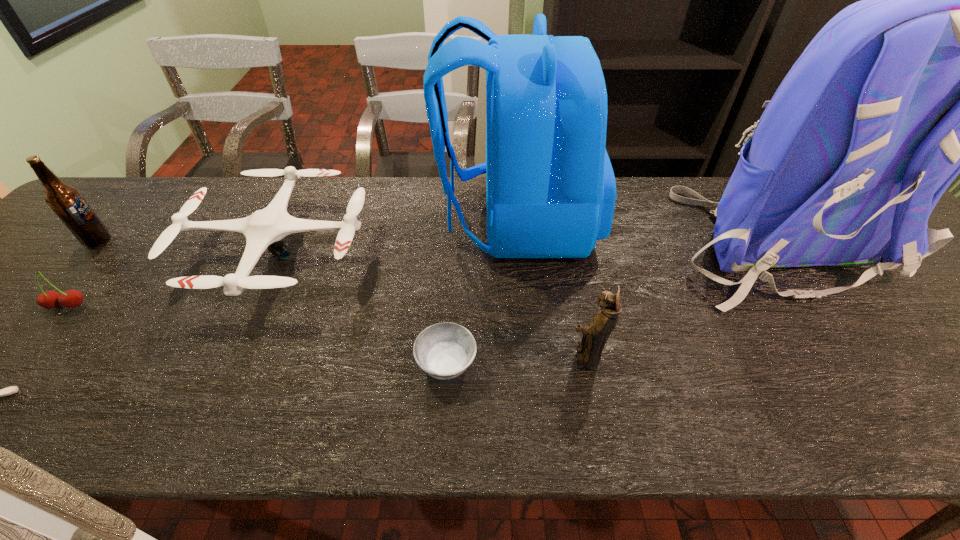
This screenshot has width=960, height=540. Find the location of `drone that is at the far edge`. drone that is at the far edge is located at coordinates (265, 228).

Where is `beer bottle at the left edge`? The width and height of the screenshot is (960, 540). beer bottle at the left edge is located at coordinates (66, 201).

Image resolution: width=960 pixels, height=540 pixels. In order to click on cherry located at the left edge in this screenshot , I will do `click(72, 298)`.

Where is `object that is at the right edge`? The width and height of the screenshot is (960, 540). object that is at the right edge is located at coordinates (959, 58).

Locate an element on the screen. The image size is (960, 540). object at the far right corner is located at coordinates (959, 58).

In the image, there is a desktop. What are the coordinates of `vacant region at the far edge` in the screenshot? It's located at (171, 213).

Identify the location of vacant space at the near edge of the desktop. The width and height of the screenshot is (960, 540). (396, 403).

Identify the location of empty location between the cherry and the ashtray. This screenshot has height=540, width=960. (256, 335).

This screenshot has width=960, height=540. Identify the location of free point between the third tallest object and the right backpack. (437, 241).

I want to click on blank region between the cherry and the seventh shortest object, so click(x=292, y=264).